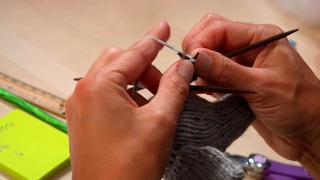
Where is `yarn snips`? Image resolution: width=320 pixels, height=180 pixels. yarn snips is located at coordinates (270, 166).